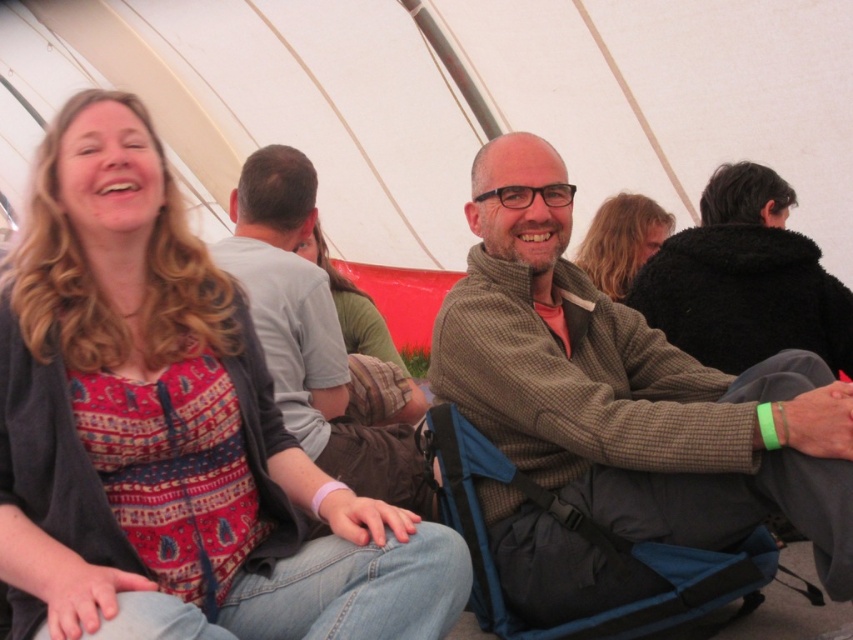
Who is taller, brown woolen sweater at center or green textured shirt at center?

With more height is brown woolen sweater at center.

Measure the distance between brown woolen sweater at center and green textured shirt at center.

brown woolen sweater at center is 1.52 meters away from green textured shirt at center.

I want to click on brown woolen sweater at center, so click(630, 388).

Is point (612, 291) closer to viewer compared to point (381, 356)?

No, (612, 291) is further to viewer.

Where is `blonde hair at center`? This screenshot has width=853, height=640. blonde hair at center is located at coordinates (622, 241).

Locate an element on the screen. This screenshot has width=853, height=640. blonde hair at center is located at coordinates (622, 241).

Can you confirm if patterned fabric shirt at upper left is smaller than brown woolen sweater at center?

Yes, patterned fabric shirt at upper left is smaller than brown woolen sweater at center.

At what (x,y) coordinates should I click in order to perform the action: click on patterned fabric shirt at upper left. Please return your answer as a coordinate pair (x, y). The height and width of the screenshot is (640, 853). Looking at the image, I should click on (170, 433).